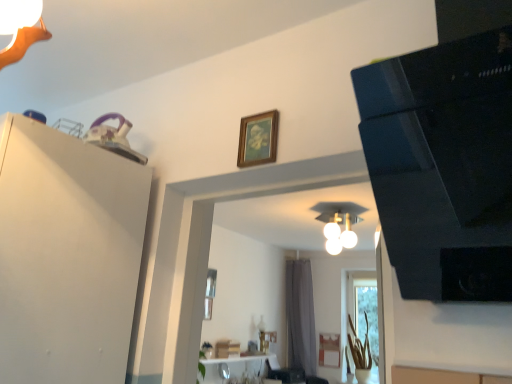
Question: Should I look upward or downward to see translucent glass vase at lower right?

Choices:
 (A) down
 (B) up

Answer: (A)

Question: Is translucent glass vase at lower right to the left of white matte dresser at upper left from the viewer's perspective?

Choices:
 (A) yes
 (B) no

Answer: (B)

Question: Is translucent glass vase at lower right placed right next to white matte dresser at upper left?

Choices:
 (A) no
 (B) yes

Answer: (A)

Question: Does translucent glass vase at lower right have a greater height compared to white matte dresser at upper left?

Choices:
 (A) no
 (B) yes

Answer: (B)

Question: Is translucent glass vase at lower right bigger than white matte dresser at upper left?

Choices:
 (A) yes
 (B) no

Answer: (B)

Question: Is translucent glass vase at lower right further to camera compared to white matte dresser at upper left?

Choices:
 (A) yes
 (B) no

Answer: (A)

Question: From the image's perspective, would you say translucent glass vase at lower right is shown under white matte dresser at upper left?

Choices:
 (A) no
 (B) yes

Answer: (B)

Question: From the image's perspective, would you say black glossy speaker at upper right is shown under wooden picture frame at upper center?

Choices:
 (A) yes
 (B) no

Answer: (B)

Question: Are black glossy speaker at upper right and wooden picture frame at upper center located far from each other?

Choices:
 (A) no
 (B) yes

Answer: (A)

Question: Does black glossy speaker at upper right have a larger size compared to wooden picture frame at upper center?

Choices:
 (A) no
 (B) yes

Answer: (B)

Question: Considering the relative sizes of black glossy speaker at upper right and wooden picture frame at upper center in the image provided, is black glossy speaker at upper right thinner than wooden picture frame at upper center?

Choices:
 (A) no
 (B) yes

Answer: (A)

Question: Is black glossy speaker at upper right closer to camera compared to wooden picture frame at upper center?

Choices:
 (A) yes
 (B) no

Answer: (A)

Question: Does black glossy speaker at upper right have a greater height compared to wooden picture frame at upper center?

Choices:
 (A) yes
 (B) no

Answer: (A)

Question: Does white glossy light fixture at center have a lesser height compared to translucent glass vase at lower right?

Choices:
 (A) no
 (B) yes

Answer: (B)